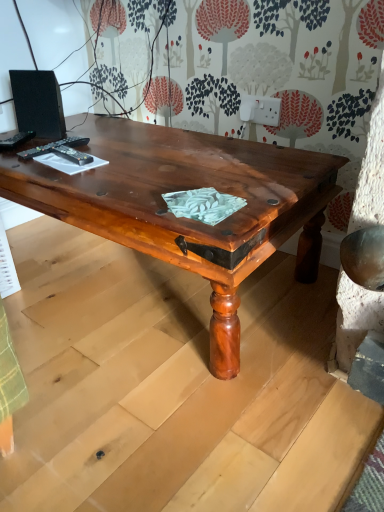
Question: From a real-world perspective, is black matte speaker at upper left under black plastic remote control at upper left, positioned as the 1th remote control in right-to-left order?

Choices:
 (A) no
 (B) yes

Answer: (A)

Question: Is black matte speaker at upper left to the left of black plastic remote control at upper left, positioned as the 1th remote control in right-to-left order, from the viewer's perspective?

Choices:
 (A) yes
 (B) no

Answer: (A)

Question: Is black matte speaker at upper left facing towards black plastic remote control at upper left, the 3th remote control viewed from the left?

Choices:
 (A) no
 (B) yes

Answer: (A)

Question: Considering the relative sizes of black matte speaker at upper left and black plastic remote control at upper left, positioned as the 1th remote control in right-to-left order, in the image provided, is black matte speaker at upper left shorter than black plastic remote control at upper left, positioned as the 1th remote control in right-to-left order,?

Choices:
 (A) yes
 (B) no

Answer: (B)

Question: Is black matte speaker at upper left oriented away from black plastic remote control at upper left, the 3th remote control viewed from the left?

Choices:
 (A) no
 (B) yes

Answer: (A)

Question: Is black matte speaker at upper left in front of black plastic remote control at upper left, positioned as the 1th remote control in right-to-left order?

Choices:
 (A) no
 (B) yes

Answer: (A)

Question: Is the position of black plastic remote control at upper left, acting as the third remote control starting from the right, more distant than that of black plastic remote control at upper left, which ranks as the 2th remote control in left-to-right order?

Choices:
 (A) yes
 (B) no

Answer: (A)

Question: Is black plastic remote control at upper left, the first remote control in the left-to-right sequence, smaller than black plastic remote control at upper left, which ranks as the 2th remote control in left-to-right order?

Choices:
 (A) no
 (B) yes

Answer: (B)

Question: Is black plastic remote control at upper left, the first remote control in the left-to-right sequence, next to black plastic remote control at upper left, the second remote control in the right-to-left sequence, and touching it?

Choices:
 (A) yes
 (B) no

Answer: (B)

Question: Can you confirm if black plastic remote control at upper left, acting as the third remote control starting from the right, is positioned to the left of black plastic remote control at upper left, which ranks as the 2th remote control in left-to-right order?

Choices:
 (A) no
 (B) yes

Answer: (B)

Question: Does black plastic remote control at upper left, acting as the third remote control starting from the right, appear on the right side of black plastic remote control at upper left, which ranks as the 2th remote control in left-to-right order?

Choices:
 (A) no
 (B) yes

Answer: (A)

Question: Does black plastic remote control at upper left, acting as the third remote control starting from the right, turn towards black plastic remote control at upper left, the second remote control in the right-to-left sequence?

Choices:
 (A) yes
 (B) no

Answer: (B)

Question: Can you confirm if black matte speaker at upper left is wider than black plastic remote control at upper left, the second remote control in the right-to-left sequence?

Choices:
 (A) yes
 (B) no

Answer: (B)